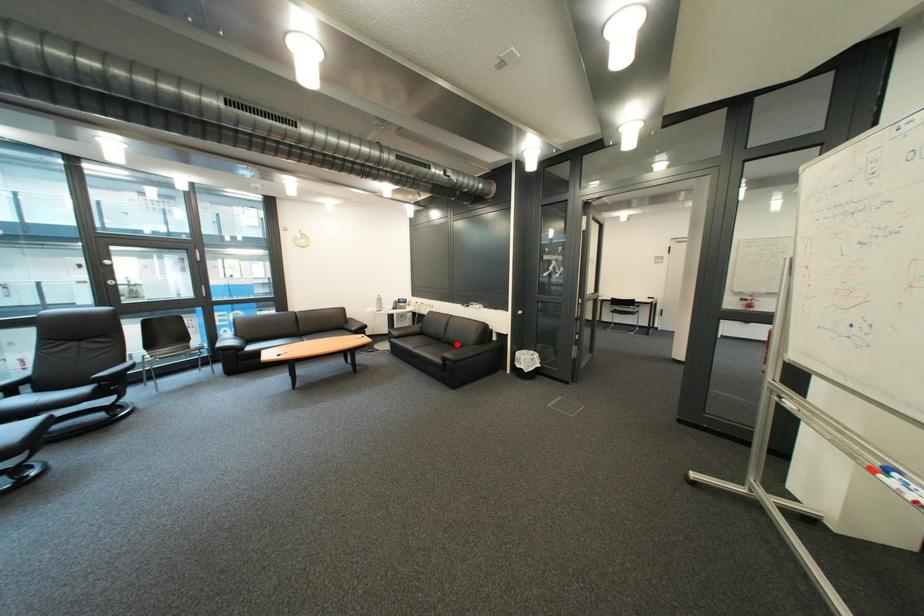
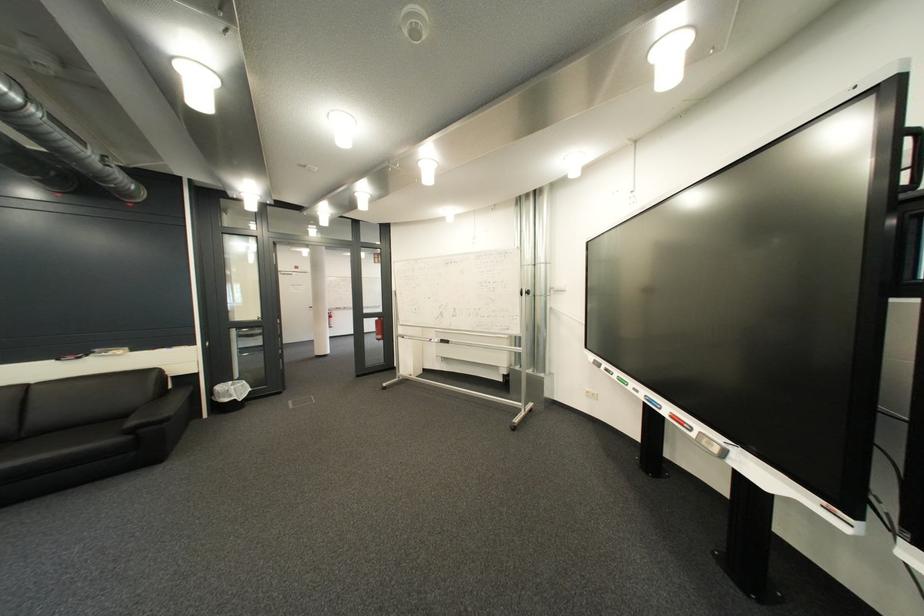
Locate, in the second image, the point that corresponds to the highlighted location in the first image.

(35, 440)